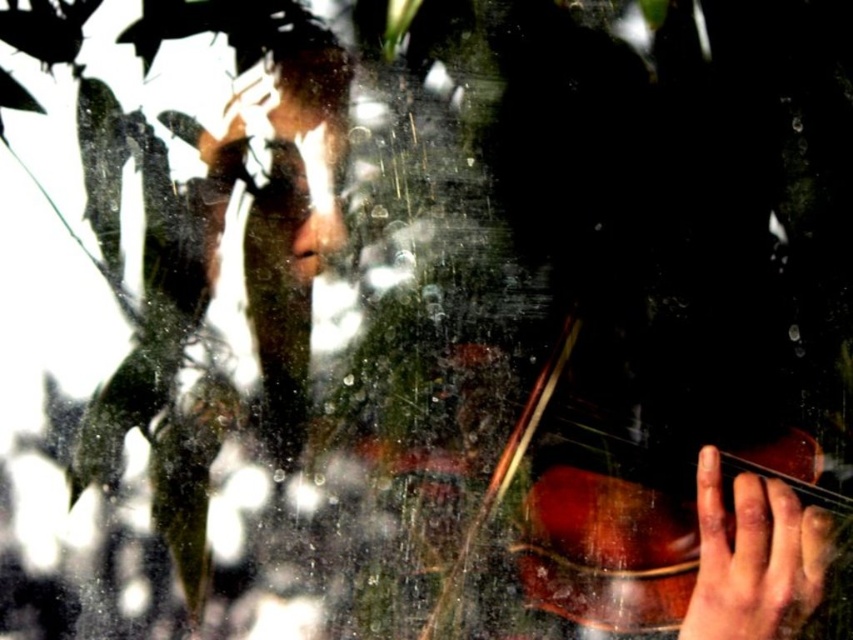
Question: Which object appears closest to the camera in this image?

Choices:
 (A) shiny brown violin at lower right
 (B) smooth skin hand at lower right

Answer: (B)

Question: Is shiny brown violin at lower right positioned at the back of smooth skin hand at lower right?

Choices:
 (A) no
 (B) yes

Answer: (B)

Question: Which point appears farthest from the camera in this image?

Choices:
 (A) (811, 576)
 (B) (619, 595)

Answer: (B)

Question: Is shiny brown violin at lower right positioned in front of smooth skin hand at lower right?

Choices:
 (A) yes
 (B) no

Answer: (B)

Question: Considering the relative positions of shiny brown violin at lower right and smooth skin hand at lower right in the image provided, where is shiny brown violin at lower right located with respect to smooth skin hand at lower right?

Choices:
 (A) left
 (B) right

Answer: (A)